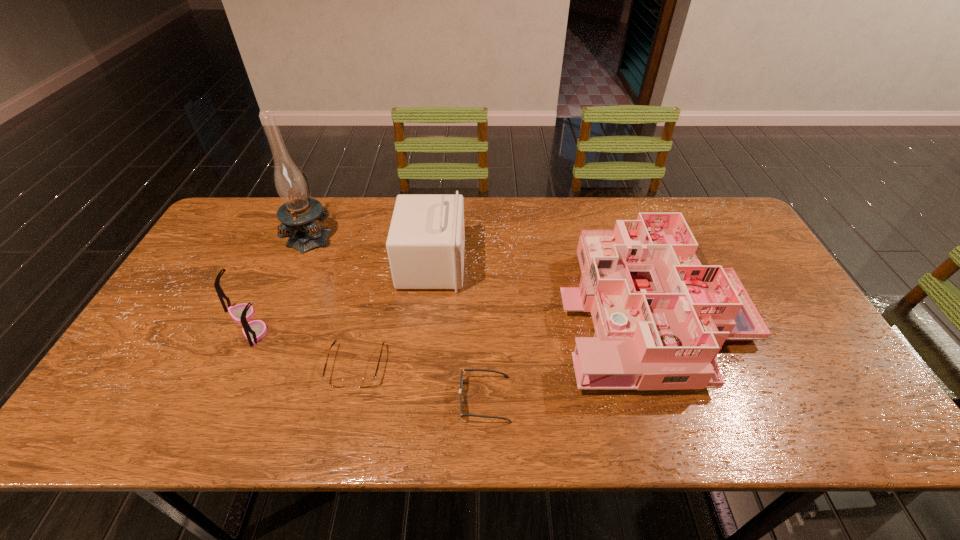
Find the location of a particular element. This screenshot has width=960, height=540. free space that is in between the tallest object and the rightmost spectacles is located at coordinates (397, 317).

At what (x,y) coordinates should I click in order to perform the action: click on empty space that is in between the dollhouse and the second spectacles from left to right. Please return your answer as a coordinate pair (x, y). The height and width of the screenshot is (540, 960). Looking at the image, I should click on (504, 337).

Where is `free space between the rightmost object and the leftmost spectacles`? The width and height of the screenshot is (960, 540). free space between the rightmost object and the leftmost spectacles is located at coordinates (449, 316).

Find the location of a particular element. vacant area between the leftmost spectacles and the first-aid kit is located at coordinates (340, 294).

Locate an element on the screen. The image size is (960, 540). free point between the tallest spectacles and the second spectacles from left to right is located at coordinates (302, 345).

Locate an element on the screen. free space between the fifth object from left to right and the tallest object is located at coordinates (397, 317).

Locate which object ranks fourth in proximity to the first-aid kit. Please provide its 2D coordinates. Your answer should be formatted as a tuple, i.e. [(x, y)], where the tuple contains the x and y coordinates of a point satisfying the conditions above.

[(660, 317)]

Locate an element on the screen. The image size is (960, 540). object that is the fifth nearest to the first-aid kit is located at coordinates (255, 330).

In order to click on spectacles that is the second closest to the rightmost spectacles in this screenshot , I will do `click(255, 330)`.

Choose which spectacles is the second nearest neighbor to the dollhouse. Please provide its 2D coordinates. Your answer should be formatted as a tuple, i.e. [(x, y)], where the tuple contains the x and y coordinates of a point satisfying the conditions above.

[(363, 382)]